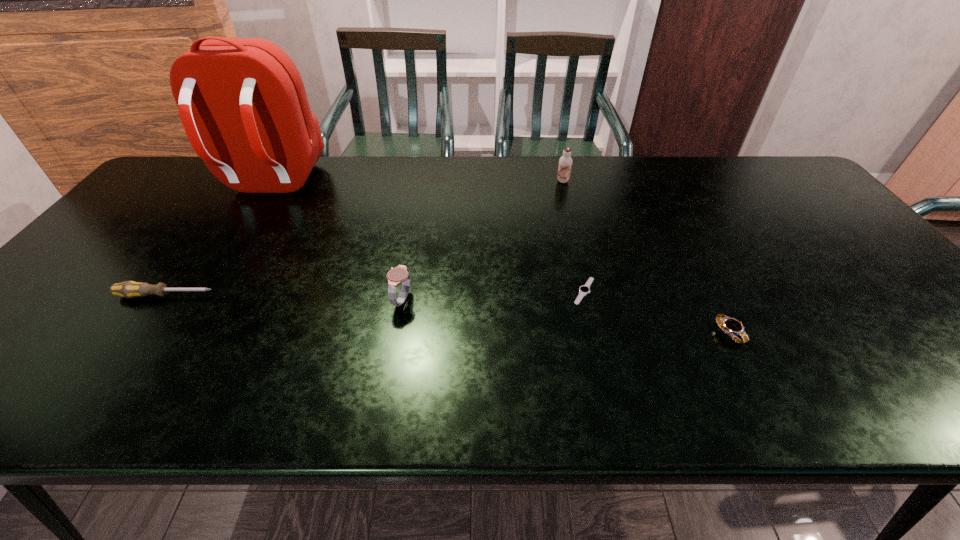
Identify the location of free space between the shortest object and the second shortest watch. (657, 312).

Where is `free space between the screwdriver and the chocolate milk`? Image resolution: width=960 pixels, height=540 pixels. free space between the screwdriver and the chocolate milk is located at coordinates (364, 239).

I want to click on object identified as the closest to the screwdriver, so click(x=242, y=102).

Locate an element on the screen. The image size is (960, 540). object that is the fifth closest to the tallest object is located at coordinates coord(730,326).

The height and width of the screenshot is (540, 960). What are the coordinates of `watch that stands as the closest to the tallest watch` in the screenshot? It's located at (585, 289).

Identify which watch is the third closest to the screwdriver. Please provide its 2D coordinates. Your answer should be formatted as a tuple, i.e. [(x, y)], where the tuple contains the x and y coordinates of a point satisfying the conditions above.

[(730, 326)]

Identify the location of vacant space that satisfies the following two spatial constraints: 1. at the tip of the screwdriver; 2. on the back side of the fifth tallest object. (139, 333).

I want to click on vacant area in the image that satisfies the following two spatial constraints: 1. on the back side of the tallest watch; 2. at the tip of the fourth tallest object, so click(402, 295).

Identify the location of free space that satisfies the following two spatial constraints: 1. on the strap side of the third object from left to right; 2. on the left side of the backpack. The height and width of the screenshot is (540, 960). (198, 300).

You are a GUI agent. You are given a task and a screenshot of the screen. Output one action in this format:
    pyautogui.click(x=<x>, y=<y>)
    Task: Click on the vacant region that satisfies the following two spatial constraints: 1. at the tip of the third shortest object; 2. on the back side of the leftmost watch
    
    Given the screenshot: What is the action you would take?
    pyautogui.click(x=163, y=300)